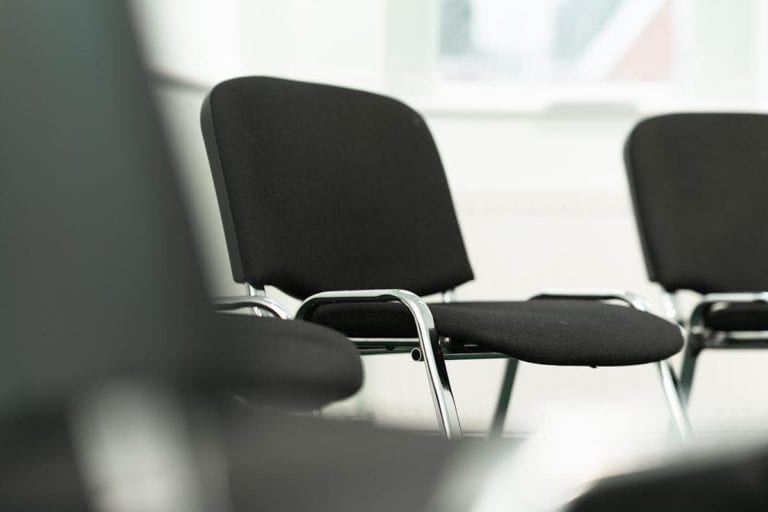
Image resolution: width=768 pixels, height=512 pixels. Identify the location of chair. (343, 193), (727, 219), (108, 279), (290, 360).